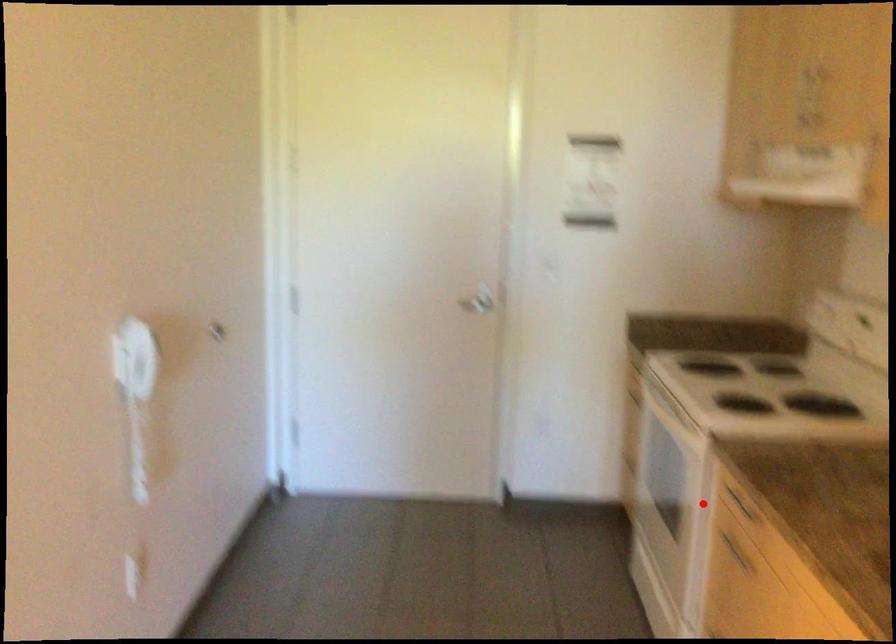
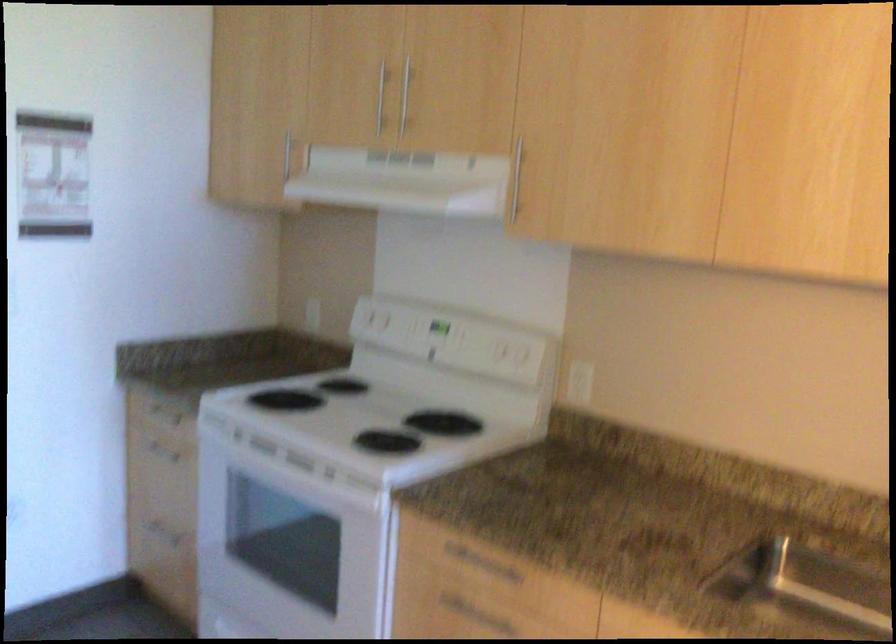
Question: A red point is marked in image1. In image2, is the corresponding 3D point closer to the camera or farther? Reply with the corresponding letter.

Choices:
 (A) The corresponding 3D point is closer.
 (B) The corresponding 3D point is farther.

Answer: (A)